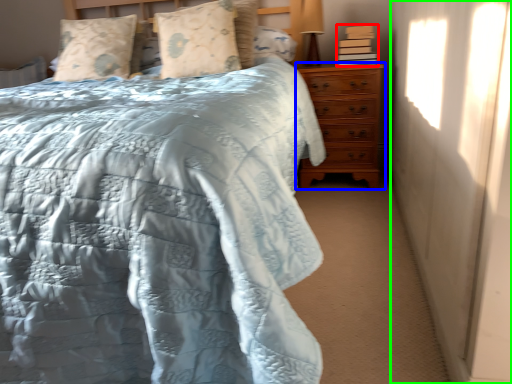
Question: Which is farther away from book (highlighted by a red box)? chest of drawers (highlighted by a blue box) or curtain (highlighted by a green box)?

Choices:
 (A) chest of drawers
 (B) curtain

Answer: (B)